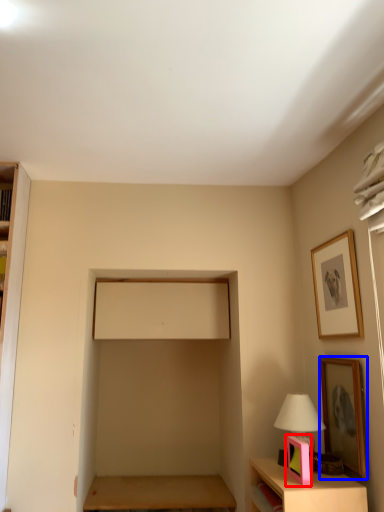
Question: Which point is further to the camera, picture frame (highlighted by a red box) or picture frame (highlighted by a blue box)?

Choices:
 (A) picture frame
 (B) picture frame

Answer: (B)